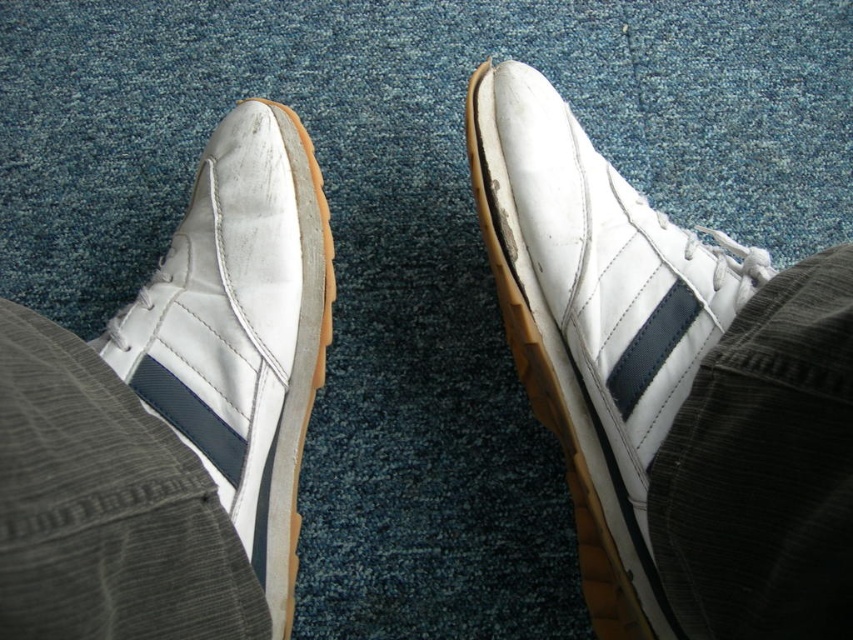
Question: Does white leather shoe at upper center have a smaller size compared to white leather shoe at left?

Choices:
 (A) no
 (B) yes

Answer: (A)

Question: Does white leather shoe at upper center have a smaller size compared to white leather shoe at left?

Choices:
 (A) yes
 (B) no

Answer: (B)

Question: Which of the following is the closest to the observer?

Choices:
 (A) (633, 332)
 (B) (184, 264)

Answer: (A)

Question: Does white leather shoe at upper center have a smaller size compared to white leather shoe at left?

Choices:
 (A) no
 (B) yes

Answer: (A)

Question: Which of the following is the farthest from the observer?

Choices:
 (A) white leather shoe at left
 (B) white leather shoe at upper center

Answer: (A)